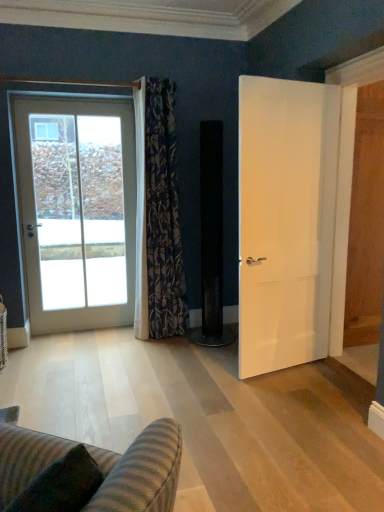
Question: Would you say floral-patterned fabric curtain at left is part of striped fabric couch at lower left's contents?

Choices:
 (A) no
 (B) yes

Answer: (A)

Question: Is striped fabric couch at lower left facing away from floral-patterned fabric curtain at left?

Choices:
 (A) yes
 (B) no

Answer: (B)

Question: Is striped fabric couch at lower left oriented towards floral-patterned fabric curtain at left?

Choices:
 (A) yes
 (B) no

Answer: (B)

Question: Can you confirm if striped fabric couch at lower left is bigger than floral-patterned fabric curtain at left?

Choices:
 (A) yes
 (B) no

Answer: (B)

Question: Can you confirm if striped fabric couch at lower left is wider than floral-patterned fabric curtain at left?

Choices:
 (A) no
 (B) yes

Answer: (B)

Question: Is striped fabric couch at lower left further to the viewer compared to floral-patterned fabric curtain at left?

Choices:
 (A) yes
 (B) no

Answer: (B)

Question: From the image's perspective, is white matte door at right, the 2th door in the left-to-right sequence, located beneath white glass door at left, which ranks as the 1th door in back-to-front order?

Choices:
 (A) yes
 (B) no

Answer: (A)

Question: Does white matte door at right, the first door in the front-to-back sequence, have a lesser width compared to white glass door at left, which is counted as the 1th door, starting from the left?

Choices:
 (A) yes
 (B) no

Answer: (A)

Question: Is white matte door at right, the 2th door in the left-to-right sequence, with white glass door at left, which ranks as the 1th door in back-to-front order?

Choices:
 (A) yes
 (B) no

Answer: (B)

Question: Considering the relative positions of white matte door at right, placed as the 1th door when sorted from right to left, and white glass door at left, which is counted as the 1th door, starting from the left, in the image provided, is white matte door at right, placed as the 1th door when sorted from right to left, behind white glass door at left, which is counted as the 1th door, starting from the left,?

Choices:
 (A) no
 (B) yes

Answer: (A)

Question: Can you confirm if white matte door at right, which is the 2th door from back to front, is taller than white glass door at left, which ranks as the 1th door in back-to-front order?

Choices:
 (A) no
 (B) yes

Answer: (A)

Question: From a real-world perspective, is white matte door at right, the 2th door in the left-to-right sequence, located beneath white glass door at left, acting as the second door starting from the front?

Choices:
 (A) yes
 (B) no

Answer: (A)

Question: Can you confirm if white glass door at left, which is counted as the 1th door, starting from the left, is positioned to the left of white matte door at right, placed as the 1th door when sorted from right to left?

Choices:
 (A) no
 (B) yes

Answer: (B)